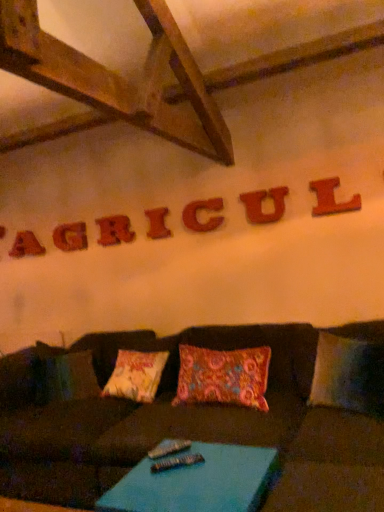
Question: From the image's perspective, is red wood letter a at upper left, which is counted as the seventh letter, starting from the right, positioned above or below wooden letter i at center, the fourth letter when ordered from back to front?

Choices:
 (A) above
 (B) below

Answer: (B)

Question: Does point (21, 251) appear closer or farther from the camera than point (162, 215)?

Choices:
 (A) closer
 (B) farther

Answer: (B)

Question: Which is farther from the rustic wood letter at upper center, marked as the third letter in a back-to-front arrangement?

Choices:
 (A) wooden letter c at center, arranged as the 5th letter when viewed from the back
 (B) blue fabric table at lower center
 (C) metallic silver remote at center
 (D) wooden letter u at center, the sixth letter viewed from the back
 (E) red wood letter a at upper left, which is counted as the 1th letter, starting from the back

Answer: (B)

Question: Estimate the real-world distances between objects in this image. Which object is farther from the wooden letter i at center, the fourth letter when ordered from back to front?

Choices:
 (A) wooden letter c at center, placed as the 3th letter when sorted from front to back
 (B) brown fabric couch at center
 (C) matte wooden letter at upper center, placed as the second letter when sorted from back to front
 (D) wooden letter l at upper right, which appears as the 1th letter when viewed from the front
 (E) red wood letter a at upper left, which is counted as the first letter, starting from the left

Answer: (B)